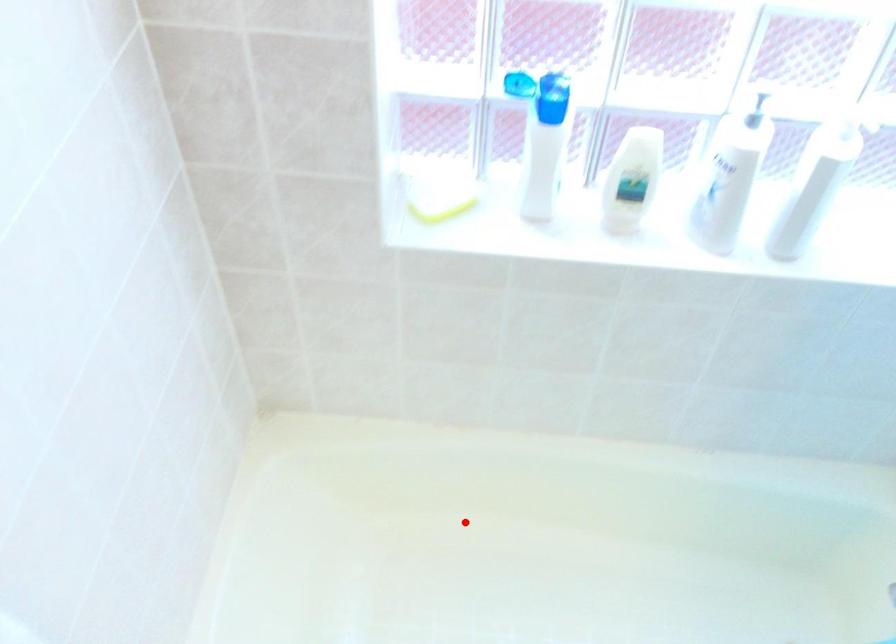
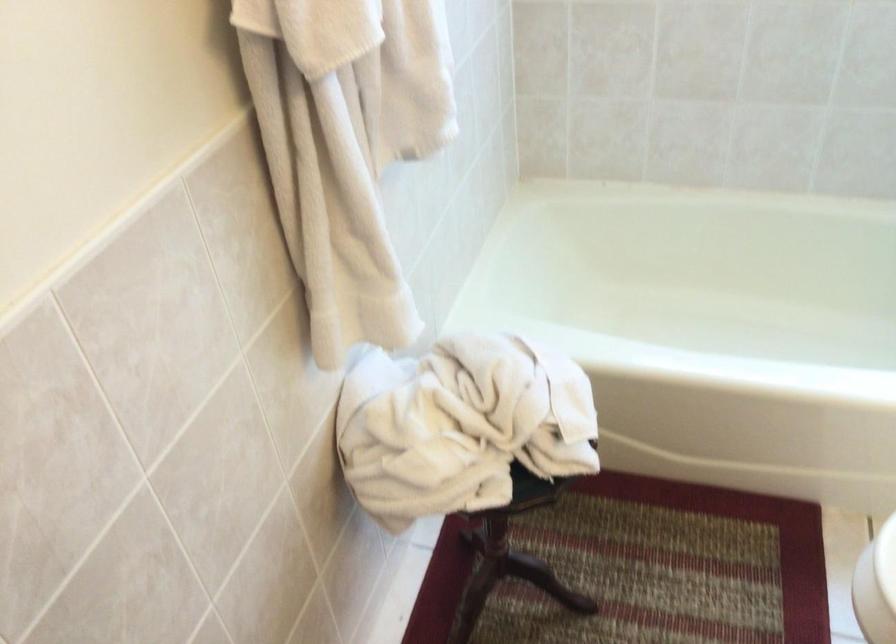
Locate, in the second image, the point that corresponds to the highlighted location in the first image.

(698, 283)